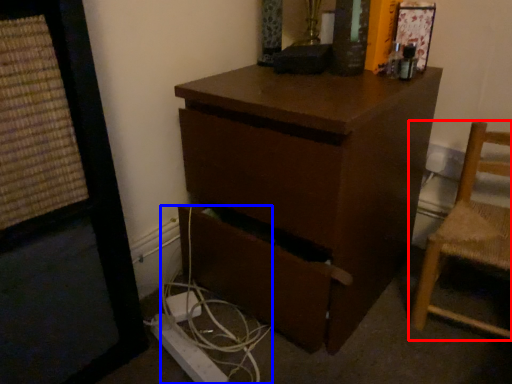
Question: Which object appears farthest to the camera in this image, chair (highlighted by a red box) or cable (highlighted by a blue box)?

Choices:
 (A) chair
 (B) cable

Answer: (B)